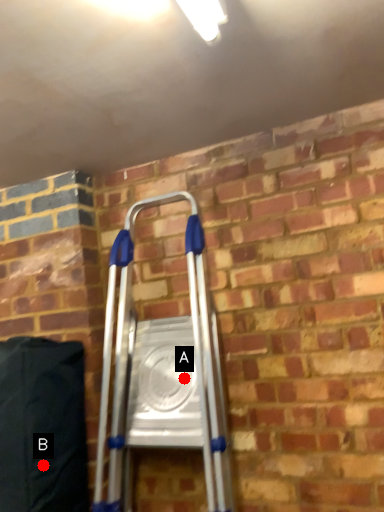
Question: Two points are circled on the image, labeled by A and B beside each circle. Which point is further to the camera?

Choices:
 (A) A is further
 (B) B is further

Answer: (A)